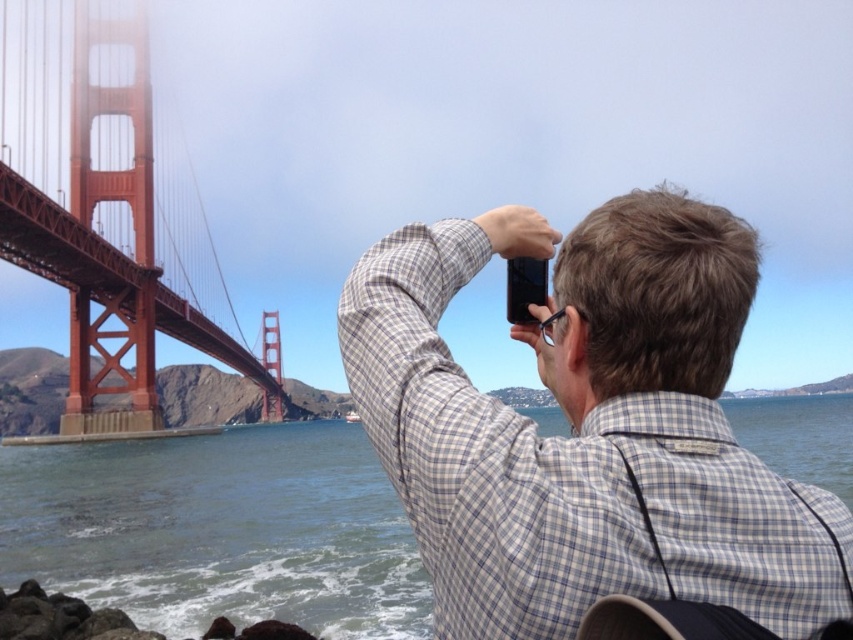
You are a photographer standing near the Golden Gate Bridge. You want to capture a photo that includes both the checkered shirt at upper right and the clear blue water at lower left. Given that your camera has a maximum zoom range of 100 meters, will you be able to fit both objects into the frame without moving closer?

The checkered shirt at upper right and clear blue water at lower left are 43.39 meters apart. Since your camera can zoom up to 100 meters, you can easily fit both objects into the frame without moving closer.

You are standing at the viewpoint of the Golden Gate Bridge and see two points marked in the scene. The first point is at coordinates point [616,499] and the second is at point [141,545]. Which point is closer to you?

Point [616,499] is in front of point [141,545], so it is closer to you.

You are standing on a pier and want to take a photo of the clear blue water at lower left and the red painted steel suspension bridge at left. Which object should you aim your camera at first if you want to capture both in one shot?

You should aim your camera at the clear blue water at lower left first because it is positioned under the red painted steel suspension bridge at left, so capturing the lower area first will include both objects in the frame.